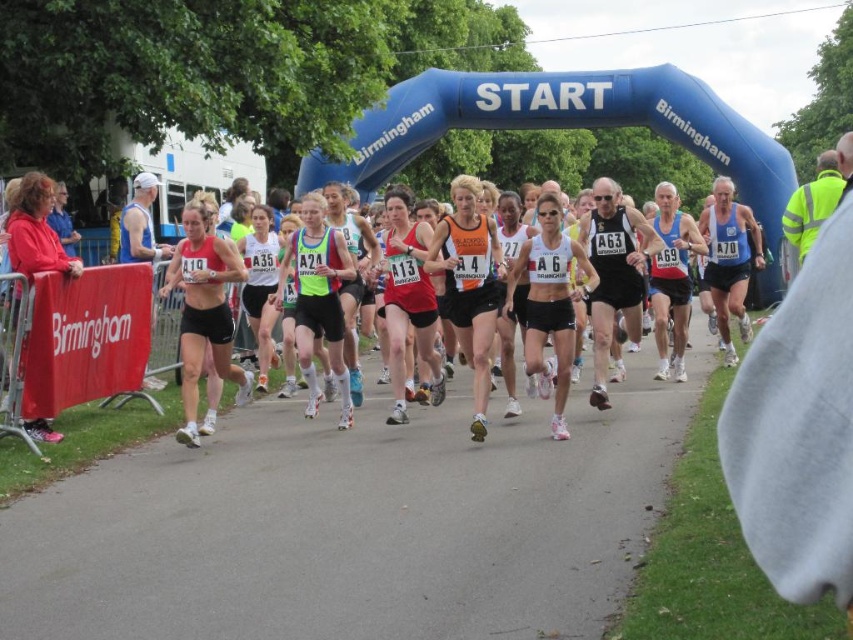
Looking at this image, is the position of asphalt road at center more distant than that of red fleece jacket at left?

That is False.

Is asphalt road at center bigger than red fleece jacket at left?

Yes, asphalt road at center is bigger than red fleece jacket at left.

Find the location of a particular element. The width and height of the screenshot is (853, 640). asphalt road at center is located at coordinates (355, 524).

Between matte red tank top at center and white matte tank top at center, which one is positioned higher?

white matte tank top at center

Locate an element on the screen. matte red tank top at center is located at coordinates (204, 310).

Which is more to the left, matte red tank top at center or red fleece jacket at left?

red fleece jacket at left is more to the left.

Is matte red tank top at center taller than red fleece jacket at left?

Yes.

Is point (202, 342) positioned before point (20, 252)?

No, it is not.

Where is `matte red tank top at center`? This screenshot has width=853, height=640. matte red tank top at center is located at coordinates (204, 310).